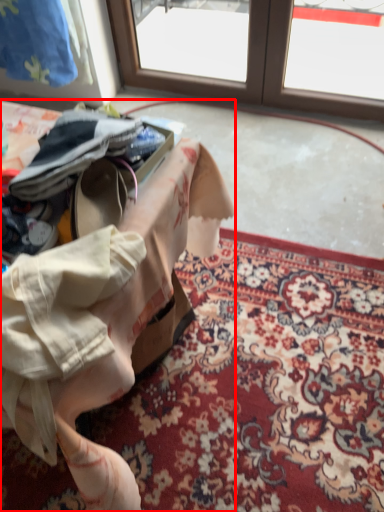
Question: From the image's perspective, what is the correct spatial relationship of table (annotated by the red box) in relation to mat?

Choices:
 (A) above
 (B) below

Answer: (A)